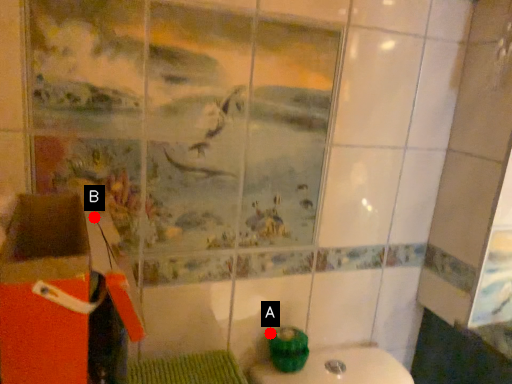
Question: Two points are circled on the image, labeled by A and B beside each circle. Which point is closer to the camera taking this photo?

Choices:
 (A) A is closer
 (B) B is closer

Answer: (B)